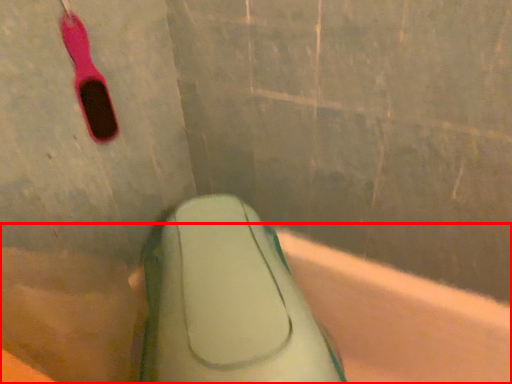
Question: From the image's perspective, what is the correct spatial positioning of bath (annotated by the red box) in reference to toothbrush?

Choices:
 (A) below
 (B) above

Answer: (A)